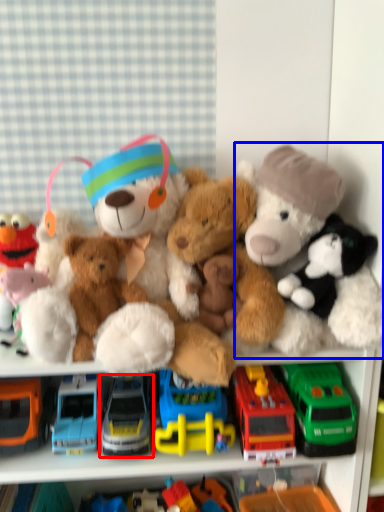
Question: Which point is further to the camera, truck (highlighted by a red box) or toy (highlighted by a blue box)?

Choices:
 (A) truck
 (B) toy

Answer: (A)